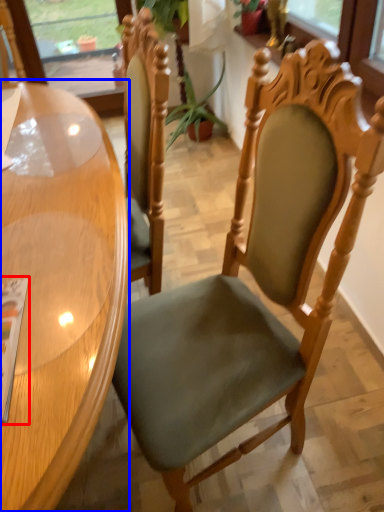
Question: Which object is closer to the camera taking this photo, magazine (highlighted by a red box) or table (highlighted by a blue box)?

Choices:
 (A) magazine
 (B) table

Answer: (B)